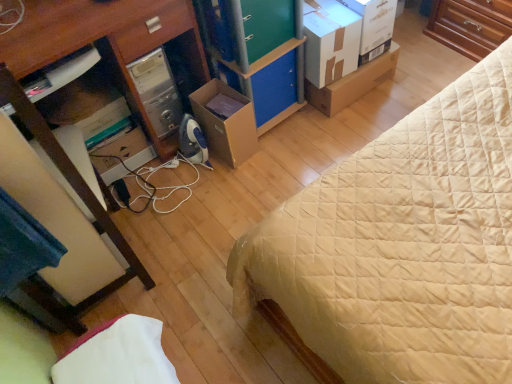
Question: From a real-world perspective, relative to blue felt drawer at center, which is the 2th drawer in top-to-bottom order, is brown wood dresser at upper right vertically above or below?

Choices:
 (A) below
 (B) above

Answer: (B)

Question: Is brown wood dresser at upper right to the left or to the right of blue felt drawer at center, which is the 2th drawer in top-to-bottom order, in the image?

Choices:
 (A) right
 (B) left

Answer: (A)

Question: Estimate the real-world distances between objects in this image. Which object is closer to the green matte cabinet at center?

Choices:
 (A) beige quilted bed at center
 (B) brown wood dresser at upper right
 (C) green matte drawer at center, the second drawer when ordered from bottom to top
 (D) cardboard box at center, which is the first cardboard box from right to left
 (E) white cardboard box at upper right, the second cardboard box positioned from the right

Answer: (C)

Question: Which of these objects is positioned farthest from the white soft mattress at lower left?

Choices:
 (A) wooden desk at left
 (B) brown cardboard box at center, which is the 1th cardboard box from left to right
 (C) green matte drawer at center, placed as the first drawer when sorted from top to bottom
 (D) cardboard box at center, which is the first cardboard box from right to left
 (E) white cardboard box at upper right

Answer: (E)